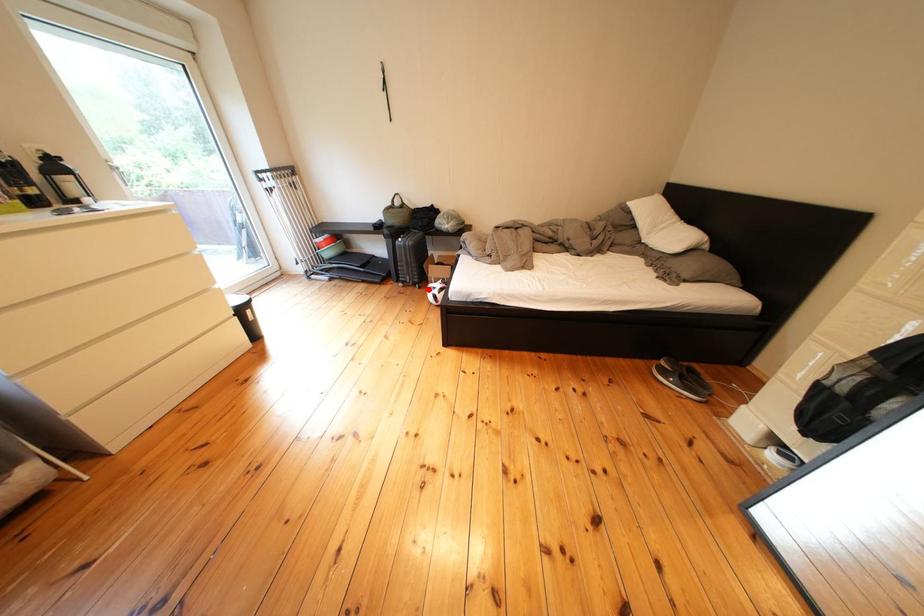
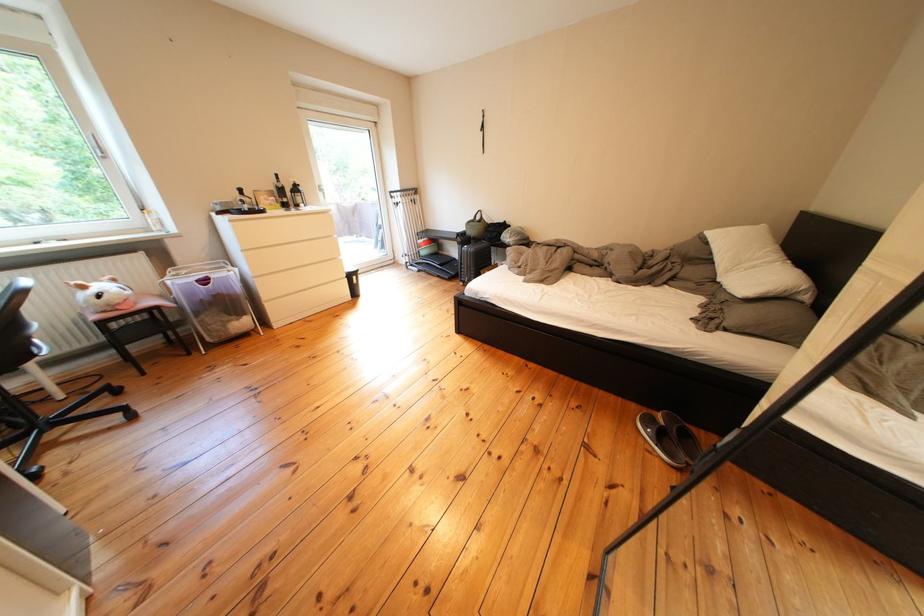
Question: I am providing you with two images of the same scene from different viewpoints. A red point is marked on the first image. Can you still see the location of the red point in image 2?

Choices:
 (A) Yes
 (B) No

Answer: (B)